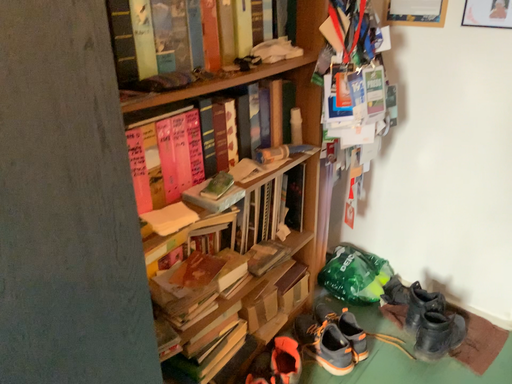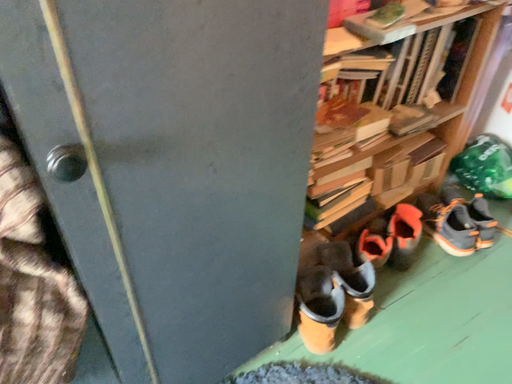
Question: How did the camera likely rotate when shooting the video?

Choices:
 (A) rotated upward
 (B) rotated downward

Answer: (B)